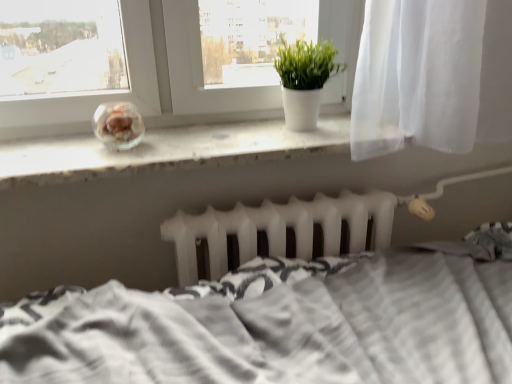
I want to click on vacant area that lies between translucent glass jar at center and green matte plant at center, so click(x=210, y=136).